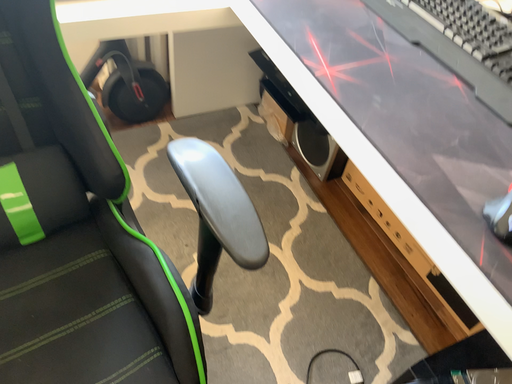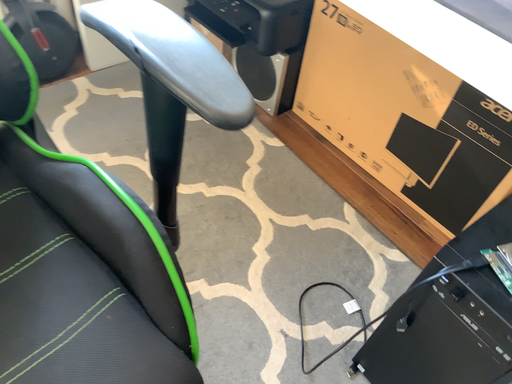
Question: How did the camera likely rotate when shooting the video?

Choices:
 (A) rotated left
 (B) rotated right

Answer: (B)